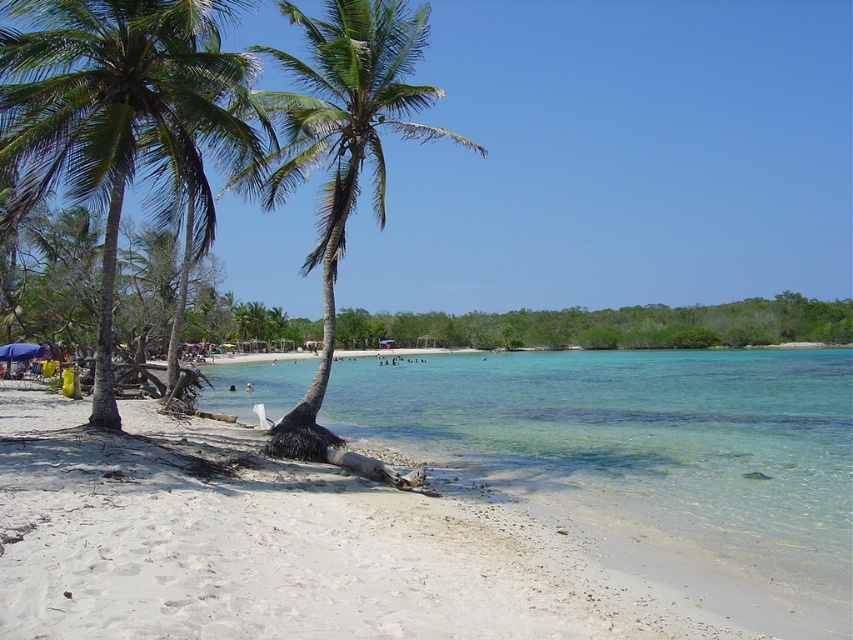
Question: Is white sandy beach at lower left bigger than green leafy palm tree at left?

Choices:
 (A) yes
 (B) no

Answer: (B)

Question: Which point appears farthest from the camera in this image?

Choices:
 (A) (389, 29)
 (B) (108, 42)
 (C) (154, 467)

Answer: (A)

Question: Can you confirm if white sandy beach at lower left is positioned above green leafy palm tree at center?

Choices:
 (A) no
 (B) yes

Answer: (A)

Question: Which object appears farthest from the camera in this image?

Choices:
 (A) white sandy beach at lower left
 (B) green leafy palm tree at center

Answer: (B)

Question: Considering the real-world distances, which object is farthest from the green leafy palm tree at center?

Choices:
 (A) green leafy palm tree at left
 (B) white sandy beach at lower left

Answer: (B)

Question: Is white sandy beach at lower left smaller than green leafy palm tree at left?

Choices:
 (A) yes
 (B) no

Answer: (A)